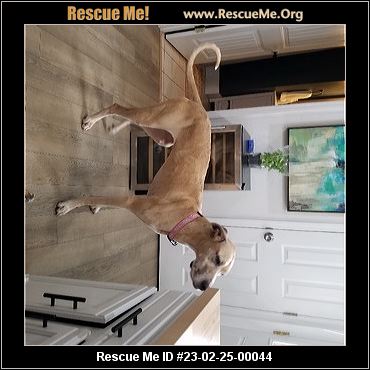
Where is `small kitchen rug`? small kitchen rug is located at coordinates (173, 74).